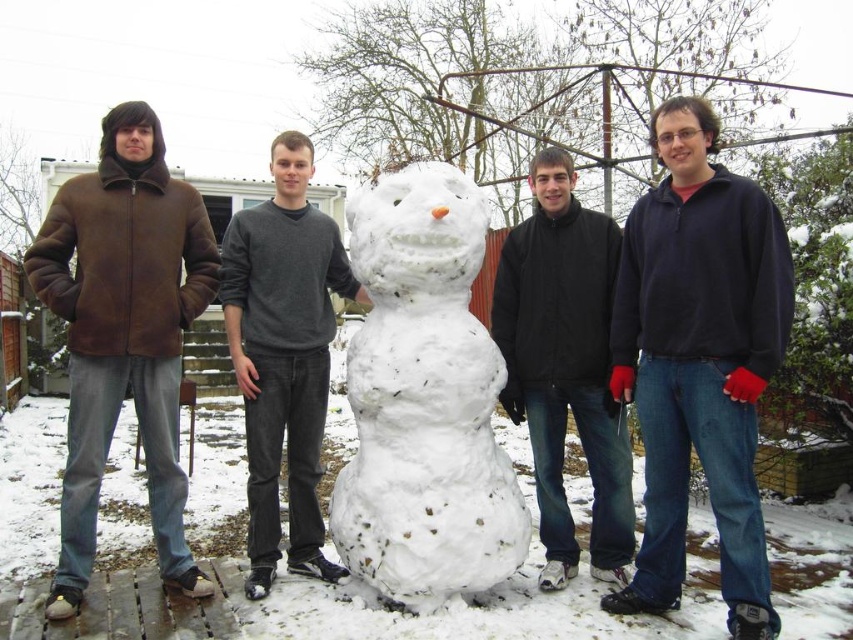
You are trying to decide whether to place a large snowball next to the white fluffy snowman at center and the brown suede jacket at left. Based on their widths, which one can accommodate the snowball without overlapping?

The white fluffy snowman at center has a greater width than the brown suede jacket at left, so placing the snowball next to the snowman would require more space. Therefore, the snowball should be placed next to the brown suede jacket at left to avoid overlapping.

You are a photographer standing 2 meters away from the snowman. You want to take a photo that includes both the black matte jacket at center and the dark gray sweater at center. Can you position yourself so that both are in the frame without moving them?

The black matte jacket at center is 1.68 meters from the dark gray sweater at center. Since the photographer is 2 meters away from the snowman, which is the central focus, the distance between the two subjects is within the photographer s typical framing range. Therefore, it should be possible to capture both in a single frame without needing to move them.